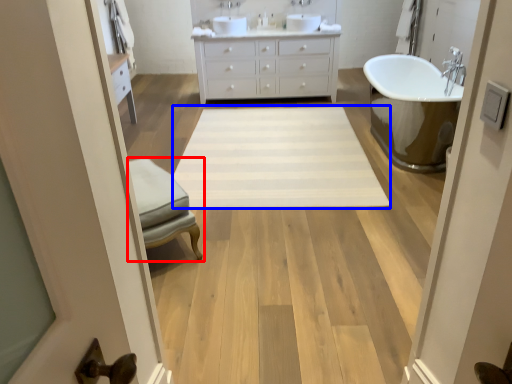
Question: Among these objects, which one is farthest to the camera, furniture (highlighted by a red box) or plain (highlighted by a blue box)?

Choices:
 (A) furniture
 (B) plain

Answer: (B)